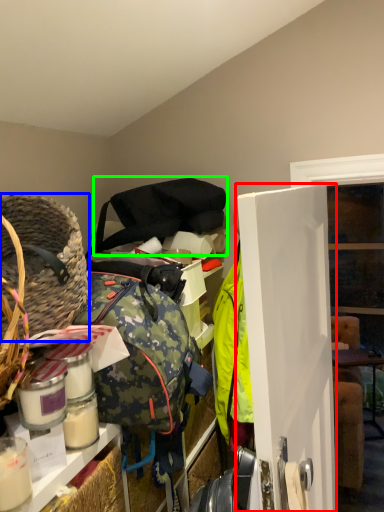
Question: Which object is positioned farthest from door (highlighted by a red box)? Select from basket (highlighted by a blue box) and shoulder bag (highlighted by a green box).

Choices:
 (A) basket
 (B) shoulder bag

Answer: (B)